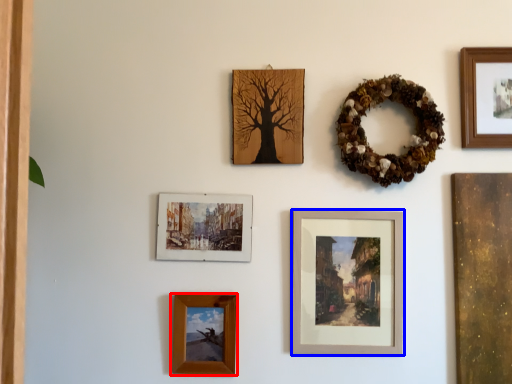
Question: Which object is further to the camera taking this photo, picture frame (highlighted by a red box) or picture frame (highlighted by a blue box)?

Choices:
 (A) picture frame
 (B) picture frame

Answer: (B)